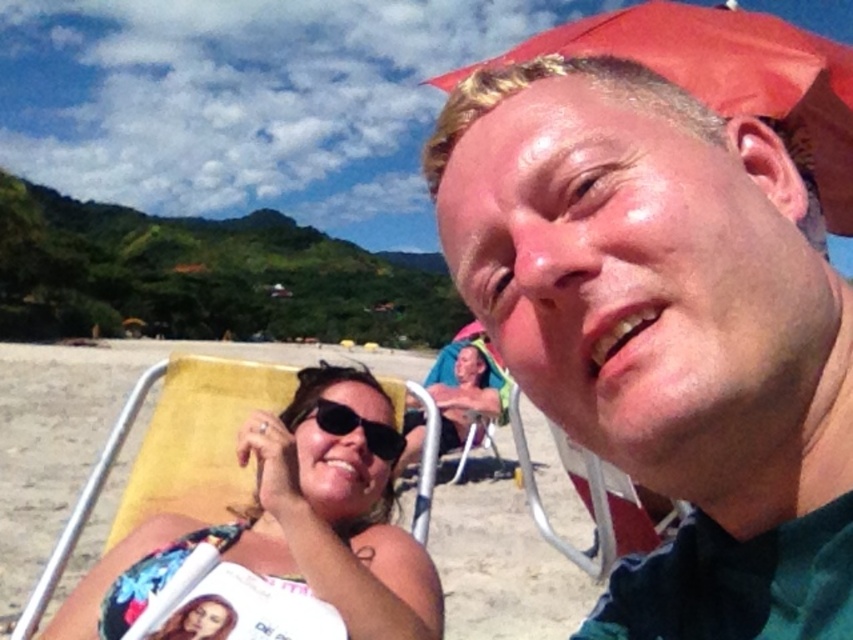
Question: Which of the following is the farthest from the observer?

Choices:
 (A) matte black sunglasses at center
 (B) black matte sunglasses at center
 (C) matte yellow towel at lower left
 (D) red fabric umbrella at upper right

Answer: (A)

Question: Which point is farther to the camera?

Choices:
 (A) (821, 305)
 (B) (332, 422)
 (C) (468, 364)
 (D) (704, 77)

Answer: (C)

Question: Which point is closer to the camera?

Choices:
 (A) black matte sunglasses at center
 (B) red fabric umbrella at upper right
 (C) matte black sunglasses at center

Answer: (B)

Question: Does matte green shirt at center have a greater width compared to red fabric umbrella at upper right?

Choices:
 (A) no
 (B) yes

Answer: (A)

Question: Observing the image, what is the correct spatial positioning of matte green shirt at center in reference to red fabric umbrella at upper right?

Choices:
 (A) above
 (B) below

Answer: (B)

Question: Can you confirm if matte yellow towel at lower left is positioned below black matte sunglasses at center?

Choices:
 (A) no
 (B) yes

Answer: (B)